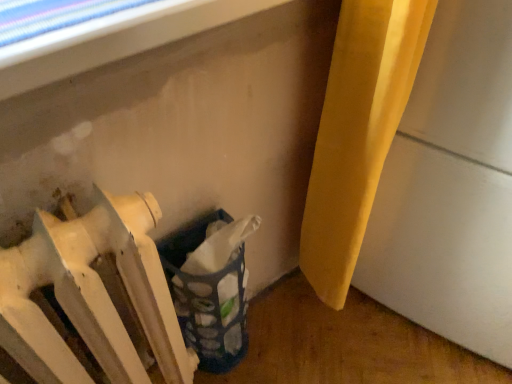
Question: Based on their sizes in the image, would you say white matte radiator at lower left is bigger or smaller than blue fabric laundry basket at lower center?

Choices:
 (A) small
 (B) big

Answer: (B)

Question: From a real-world perspective, is white matte radiator at lower left positioned above or below blue fabric laundry basket at lower center?

Choices:
 (A) above
 (B) below

Answer: (A)

Question: In the image, is white matte radiator at lower left positioned in front of or behind blue fabric laundry basket at lower center?

Choices:
 (A) front
 (B) behind

Answer: (A)

Question: Considering their positions, is blue fabric laundry basket at lower center located in front of or behind white matte radiator at lower left?

Choices:
 (A) behind
 (B) front

Answer: (A)

Question: Do you think blue fabric laundry basket at lower center is within white matte radiator at lower left, or outside of it?

Choices:
 (A) inside
 (B) outside

Answer: (B)

Question: From their relative heights in the image, would you say blue fabric laundry basket at lower center is taller or shorter than white matte radiator at lower left?

Choices:
 (A) short
 (B) tall

Answer: (A)

Question: Considering the positions of blue fabric laundry basket at lower center and white matte radiator at lower left in the image, is blue fabric laundry basket at lower center wider or thinner than white matte radiator at lower left?

Choices:
 (A) wide
 (B) thin

Answer: (B)